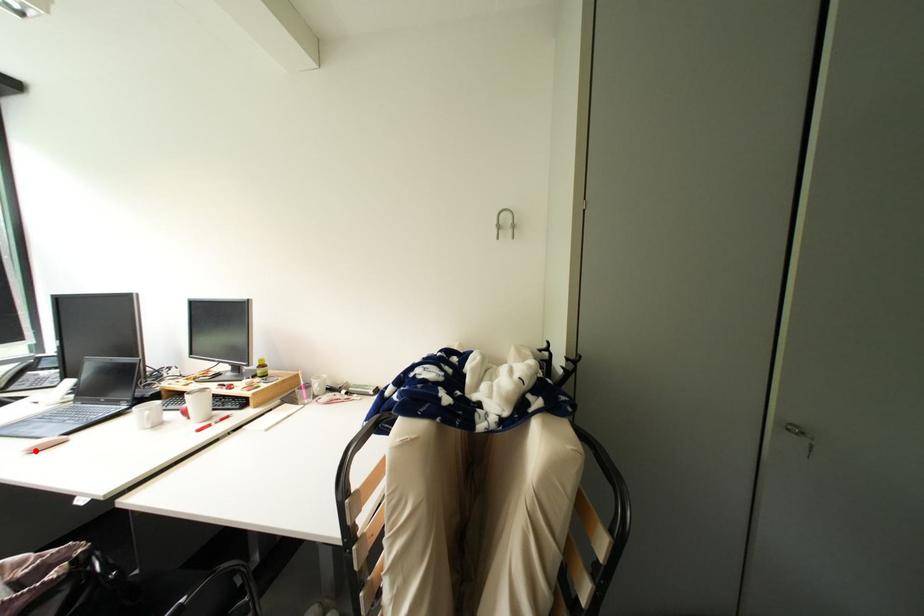
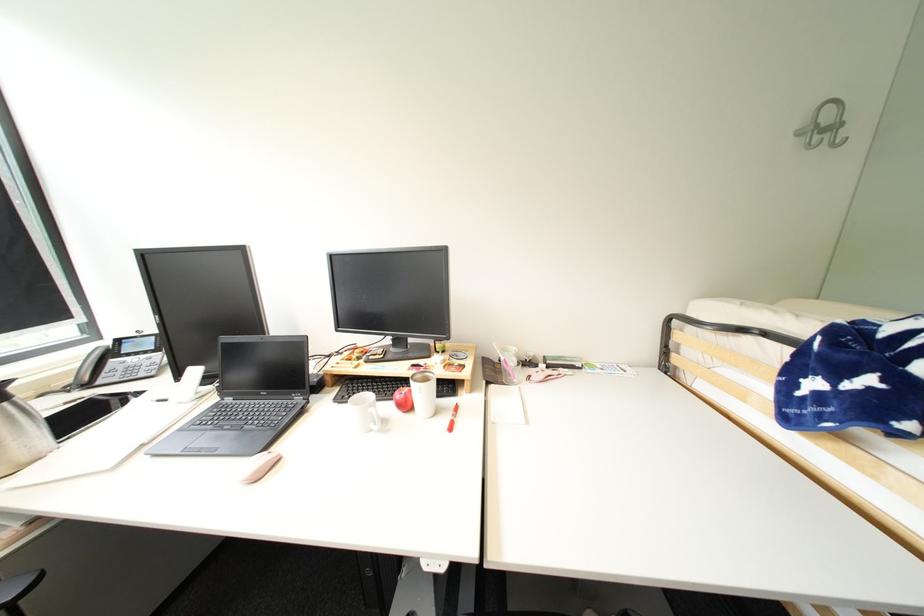
Question: I am providing you with two images of the same scene from different viewpoints. A red point is shown in image1. For the corresponding object point in image2, is it positioned nearer or farther from the camera?

Choices:
 (A) Nearer
 (B) Farther

Answer: (B)